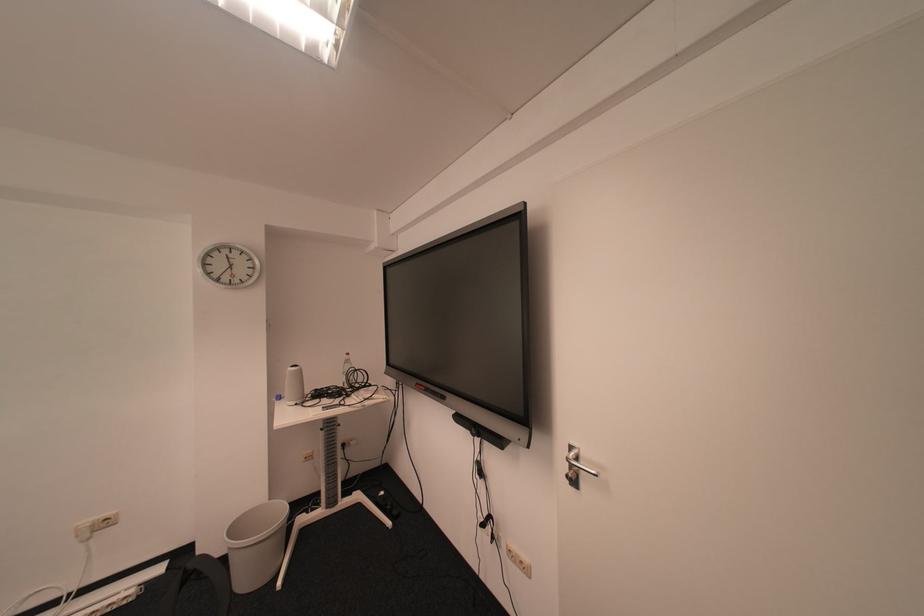
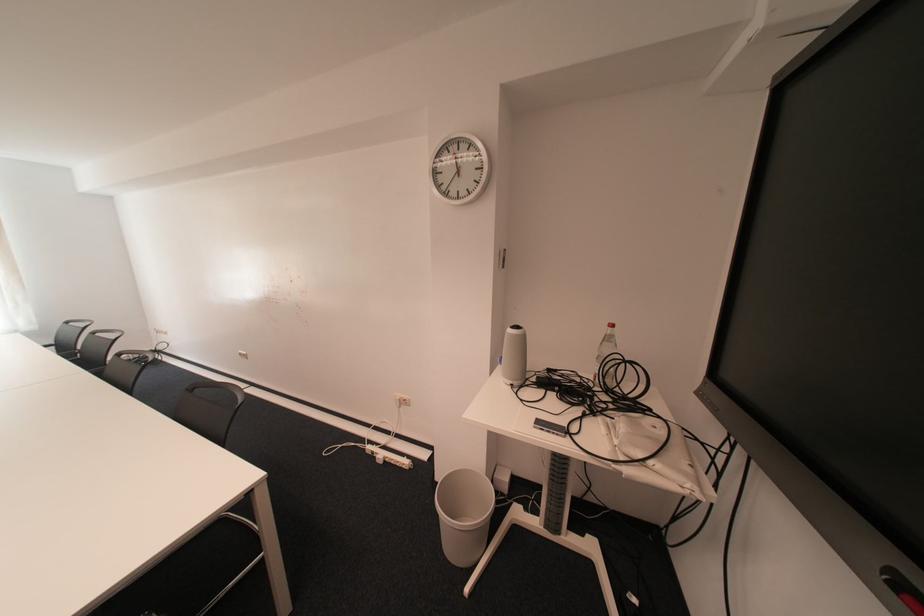
Locate, in the second image, the point that corresponds to [334,411] in the first image.

(545, 428)